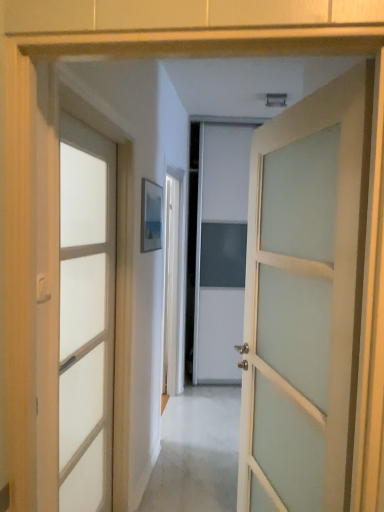
Question: From the image's perspective, is satin white door at left, marked as the second door in a right-to-left arrangement, below white frosted glass door at center, positioned as the second door in left-to-right order?

Choices:
 (A) no
 (B) yes

Answer: (B)

Question: Considering the relative sizes of satin white door at left, marked as the second door in a right-to-left arrangement, and white frosted glass door at center, positioned as the second door in left-to-right order, in the image provided, is satin white door at left, marked as the second door in a right-to-left arrangement, smaller than white frosted glass door at center, positioned as the second door in left-to-right order,?

Choices:
 (A) no
 (B) yes

Answer: (B)

Question: Is satin white door at left, placed as the first door when sorted from left to right, further to camera compared to white frosted glass door at center, positioned as the second door in left-to-right order?

Choices:
 (A) no
 (B) yes

Answer: (B)

Question: Considering the relative sizes of satin white door at left, placed as the first door when sorted from left to right, and white frosted glass door at center, which is the 1th door in right-to-left order, in the image provided, is satin white door at left, placed as the first door when sorted from left to right, shorter than white frosted glass door at center, which is the 1th door in right-to-left order,?

Choices:
 (A) no
 (B) yes

Answer: (A)

Question: Considering the relative sizes of satin white door at left, placed as the first door when sorted from left to right, and white frosted glass door at center, positioned as the second door in left-to-right order, in the image provided, is satin white door at left, placed as the first door when sorted from left to right, thinner than white frosted glass door at center, positioned as the second door in left-to-right order,?

Choices:
 (A) no
 (B) yes

Answer: (B)

Question: Does satin white door at left, placed as the first door when sorted from left to right, appear on the right side of white frosted glass door at center, positioned as the second door in left-to-right order?

Choices:
 (A) yes
 (B) no

Answer: (B)

Question: Considering the relative positions of white frosted glass door at center, which is the 1th door in right-to-left order, and satin white door at left, placed as the first door when sorted from left to right, in the image provided, is white frosted glass door at center, which is the 1th door in right-to-left order, in front of satin white door at left, placed as the first door when sorted from left to right,?

Choices:
 (A) yes
 (B) no

Answer: (A)

Question: Does white frosted glass door at center, which is the 1th door in right-to-left order, come behind satin white door at left, placed as the first door when sorted from left to right?

Choices:
 (A) no
 (B) yes

Answer: (A)

Question: From the image's perspective, is white frosted glass door at center, which is the 1th door in right-to-left order, located beneath satin white door at left, marked as the second door in a right-to-left arrangement?

Choices:
 (A) no
 (B) yes

Answer: (A)

Question: Is white frosted glass door at center, which is the 1th door in right-to-left order, thinner than satin white door at left, placed as the first door when sorted from left to right?

Choices:
 (A) no
 (B) yes

Answer: (A)

Question: Is white frosted glass door at center, positioned as the second door in left-to-right order, located outside satin white door at left, marked as the second door in a right-to-left arrangement?

Choices:
 (A) no
 (B) yes

Answer: (B)

Question: Is there a large distance between white frosted glass door at center, positioned as the second door in left-to-right order, and satin white door at left, marked as the second door in a right-to-left arrangement?

Choices:
 (A) yes
 (B) no

Answer: (B)

Question: Considering the positions of white frosted glass door at center, positioned as the second door in left-to-right order, and satin white door at left, marked as the second door in a right-to-left arrangement, in the image, is white frosted glass door at center, positioned as the second door in left-to-right order, wider or thinner than satin white door at left, marked as the second door in a right-to-left arrangement,?

Choices:
 (A) wide
 (B) thin

Answer: (A)